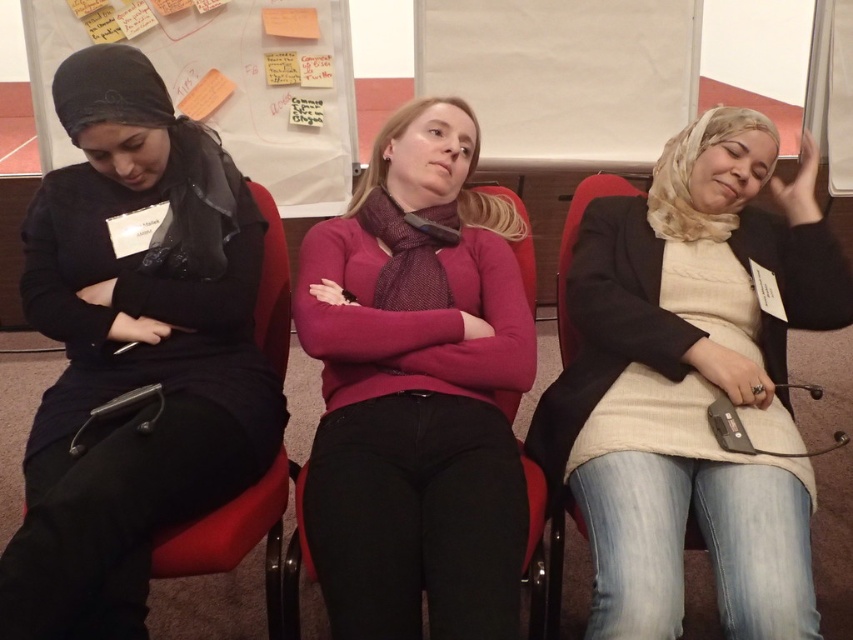
You are organizing a small event and need to arrange a row of chairs for three people. The chairs are currently placed in a straight line. You want to ensure that the light beige sweater at center is visible from the front without being blocked by the white paperboard at upper center. Based on their sizes, can you confirm if this arrangement is possible?

The light beige sweater at center has a smaller width than the white paperboard at upper center. Since the sweater is narrower, it can be positioned in a way that allows it to be seen from the front without being obscured by the wider white paperboard at upper center.